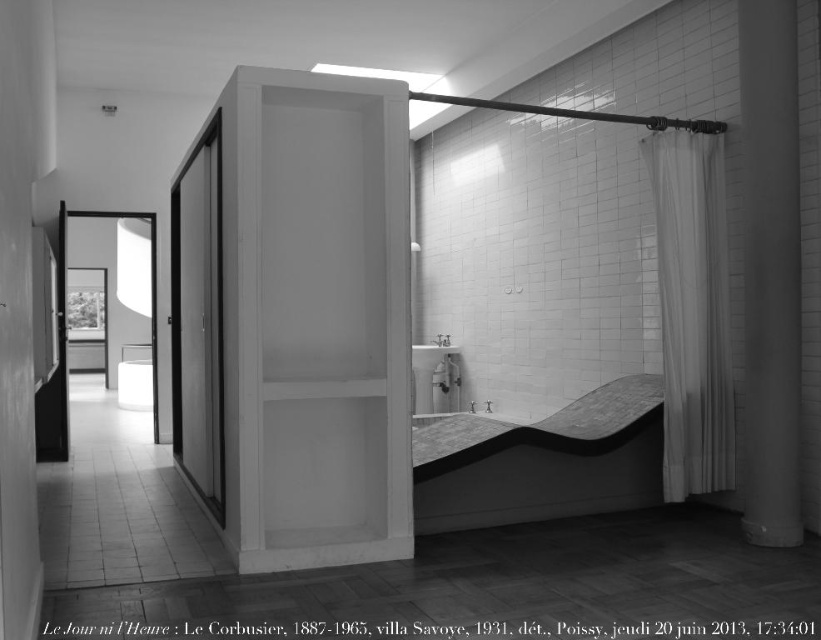
Question: Which object appears closest to the camera in this image?

Choices:
 (A) smooth gray stone bathtub at lower right
 (B) white glossy sink at center

Answer: (A)

Question: Is white sheer curtain at right positioned in front of white glossy sink at center?

Choices:
 (A) no
 (B) yes

Answer: (B)

Question: Which of the following is the closest to the observer?

Choices:
 (A) smooth gray stone bathtub at lower right
 (B) white sheer curtain at right

Answer: (A)

Question: Considering the relative positions of smooth gray stone bathtub at lower right and white glossy sink at center in the image provided, where is smooth gray stone bathtub at lower right located with respect to white glossy sink at center?

Choices:
 (A) right
 (B) left

Answer: (A)

Question: Which of the following is the farthest from the observer?

Choices:
 (A) white sheer curtain at right
 (B) smooth gray stone bathtub at lower right

Answer: (A)

Question: Does smooth gray stone bathtub at lower right have a lesser width compared to white sheer curtain at right?

Choices:
 (A) yes
 (B) no

Answer: (B)